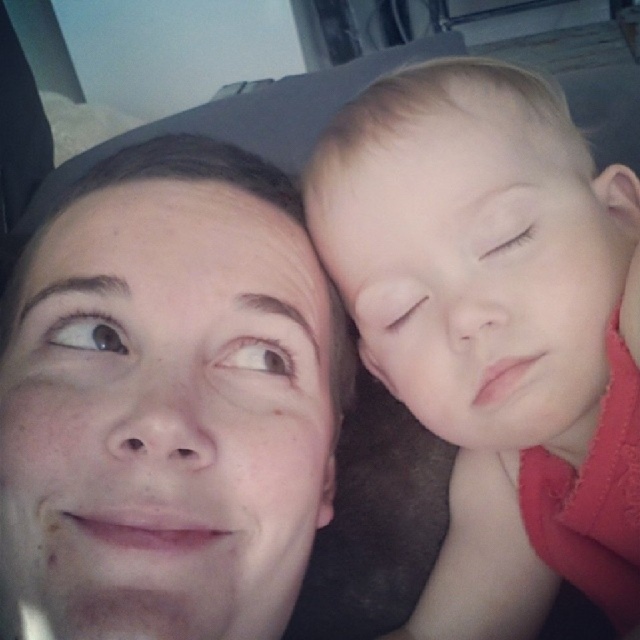
You are a photographer trying to capture a close portrait of the smooth skin face at upper left and the smooth skin baby at right. Since you want both subjects to be in focus, which one should you adjust the camera focus to prioritize based on their sizes?

The smooth skin face at upper left has a smaller size compared to the smooth skin baby at right. To ensure both are in focus, prioritize focusing on the smaller subject, the smooth skin face at upper left, as it requires more precise focus due to its smaller size.

You are a photographer adjusting the focus of your camera. You want to ensure both the smooth skin face at upper left and the smooth skin baby at right are in focus. Given that the depth of field can only sharply focus on one subject at a time, which subject should you focus on to prioritize the one closer to you?

The smooth skin face at upper left is closer to the viewer than the smooth skin baby at right. To prioritize the closer subject, you should focus on the smooth skin face at upper left.

You are a photographer adjusting the lighting for a portrait. You need to ensure that the smooth skin face at upper left and the smooth skin baby at right are both well lit. Given their heights, which subject should you adjust the light for first to avoid shadows?

The smooth skin face at upper left is shorter than the smooth skin baby at right, so you should adjust the light for the smooth skin baby at right first to ensure proper lighting without casting shadows on the shorter subject.